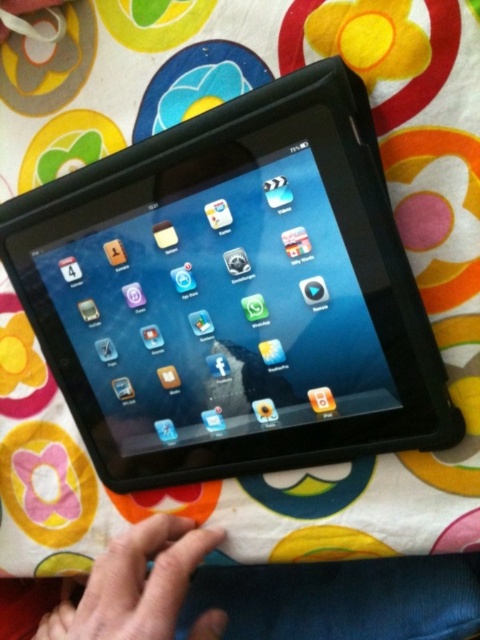
Question: Which object is farther from the camera taking this photo?

Choices:
 (A) skinny flesh-toned hand at lower left
 (B) black matte tablet at center

Answer: (B)

Question: Considering the relative positions of black matte tablet at center and skinny flesh-toned hand at lower left in the image provided, where is black matte tablet at center located with respect to skinny flesh-toned hand at lower left?

Choices:
 (A) above
 (B) below

Answer: (A)

Question: Does black matte tablet at center have a larger size compared to skinny flesh-toned hand at lower left?

Choices:
 (A) yes
 (B) no

Answer: (A)

Question: Is black matte tablet at center to the left of skinny flesh-toned hand at lower left from the viewer's perspective?

Choices:
 (A) no
 (B) yes

Answer: (A)